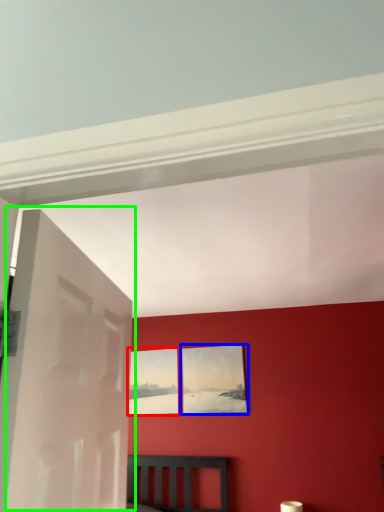
Question: Considering the real-world distances, which object is closest to picture frame (highlighted by a red box)? picture frame (highlighted by a blue box) or door (highlighted by a green box).

Choices:
 (A) picture frame
 (B) door

Answer: (A)